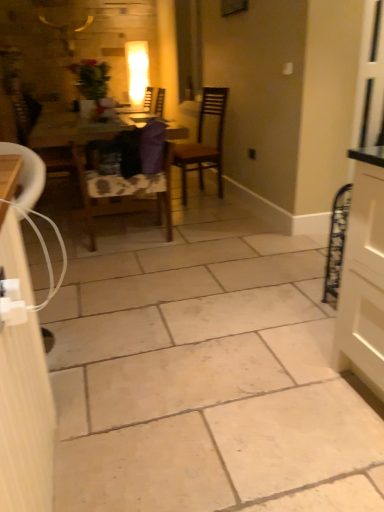
Question: Is point (49, 155) closer or farther from the camera than point (46, 398)?

Choices:
 (A) farther
 (B) closer

Answer: (A)

Question: From a real-world perspective, is wooden chair at left, marked as the 1th chair in a left-to-right arrangement, positioned above or below white glossy cabinet at left?

Choices:
 (A) below
 (B) above

Answer: (B)

Question: Estimate the real-world distances between objects in this image. Which object is farther from the white glossy cabinet at left?

Choices:
 (A) wooden chair at center, arranged as the second chair when viewed from the right
 (B) wooden chair at left, marked as the 1th chair in a left-to-right arrangement
 (C) wooden table at center
 (D) brown wooden chair at center, which is the third chair from left to right

Answer: (D)

Question: Which object is the closest to the wooden table at center?

Choices:
 (A) brown wooden chair at center, which is the third chair from left to right
 (B) wooden chair at left, marked as the 1th chair in a left-to-right arrangement
 (C) white glossy cabinet at left
 (D) wooden chair at center, arranged as the second chair when viewed from the right

Answer: (B)